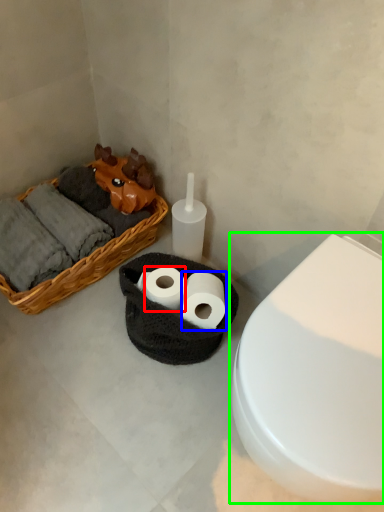
Question: Which object is positioned farthest from toilet paper (highlighted by a red box)? Select from toilet paper (highlighted by a blue box) and toilet (highlighted by a green box).

Choices:
 (A) toilet paper
 (B) toilet

Answer: (B)